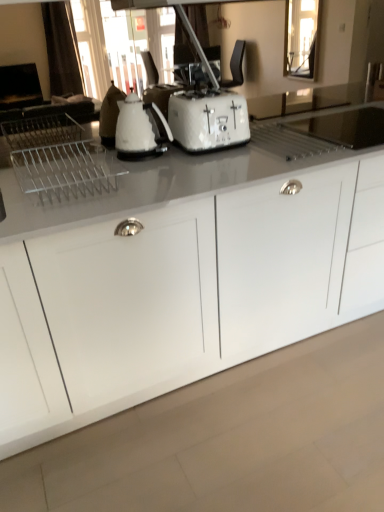
The width and height of the screenshot is (384, 512). In order to click on empty space that is ontop of white glossy cabinet at center (from a real-world perspective) in this screenshot , I will do `click(192, 162)`.